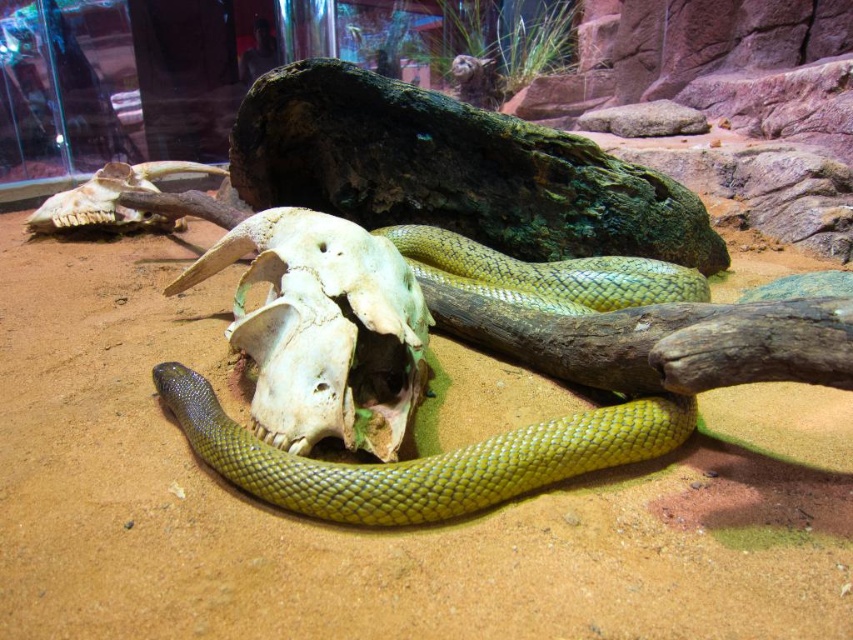
You are a zookeeper inspecting the enclosure. You notice the green glossy snake at center and the white bone skull at center. Which object is shorter in height?

The green glossy snake at center is shorter in height compared to the white bone skull at center.

You are a zookeeper preparing to clean the enclosure. You need to move the green glossy snake at center and the white bone skull at center. Which object is closer to the right edge of the enclosure?

The green glossy snake at center is positioned on the right side of the white bone skull at center, so it is closer to the right edge of the enclosure.

Looking at this image, you are a zookeeper tasked with preparing a feeding area for the green glossy snake at center and the white bone skull at center. The feeding area has a width of 30 cm. Can both objects fit side by side without overlapping?

The green glossy snake at center is wider than the white bone skull at center. Since the total width of both objects combined would exceed the 30 cm feeding area, they cannot fit side by side without overlapping.